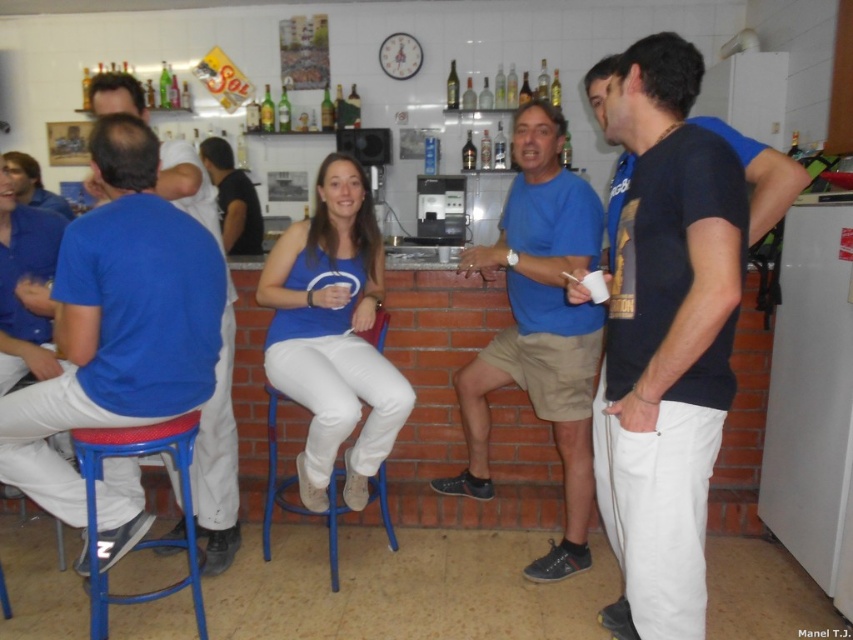
Question: Which point appears farthest from the camera in this image?

Choices:
 (A) (640, 387)
 (B) (550, 556)
 (C) (337, 211)

Answer: (B)

Question: Among these objects, which one is farthest from the camera?

Choices:
 (A) blue cotton shirt at left
 (B) matte blue tank top at center
 (C) black cotton shirt at center

Answer: (C)

Question: In this image, where is blue plastic stool at lower left located relative to black cotton shirt at center?

Choices:
 (A) below
 (B) above

Answer: (A)

Question: Among these objects, which one is nearest to the camera?

Choices:
 (A) blue cotton shirt at left
 (B) black cotton shirt at center
 (C) blue metal bar stool at center

Answer: (A)

Question: Does matte blue tank top at center appear on the left side of blue plastic stool at lower left?

Choices:
 (A) yes
 (B) no

Answer: (B)

Question: Is blue cotton shirt at center to the right of matte blue tank top at center from the viewer's perspective?

Choices:
 (A) yes
 (B) no

Answer: (A)